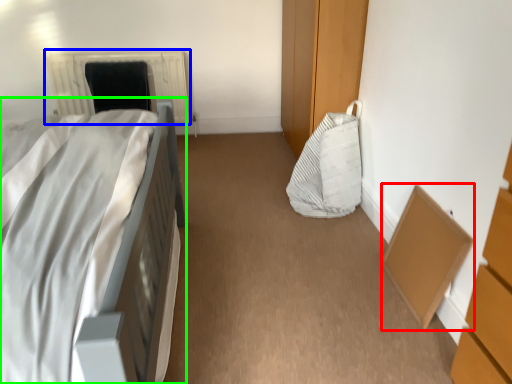
Question: Based on their relative distances, which object is nearer to cardboard box (highlighted by a red box)? Choose from radiator (highlighted by a blue box) and bed (highlighted by a green box).

Choices:
 (A) radiator
 (B) bed

Answer: (B)